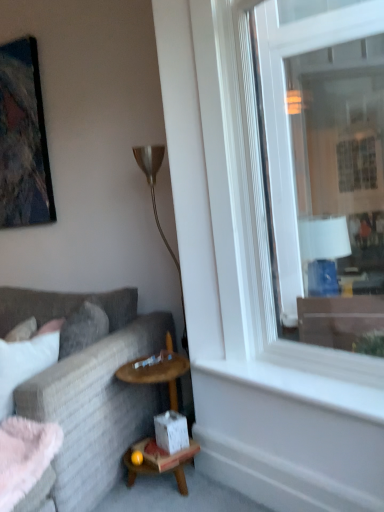
Question: Can you confirm if metallic gold floor lamp at center is positioned to the left of white smooth window sill at lower right?

Choices:
 (A) yes
 (B) no

Answer: (A)

Question: From the image's perspective, is metallic gold floor lamp at center below white smooth window sill at lower right?

Choices:
 (A) yes
 (B) no

Answer: (B)

Question: Can you confirm if metallic gold floor lamp at center is bigger than white smooth window sill at lower right?

Choices:
 (A) yes
 (B) no

Answer: (A)

Question: From a real-world perspective, is metallic gold floor lamp at center on top of white smooth window sill at lower right?

Choices:
 (A) no
 (B) yes

Answer: (B)

Question: Is white smooth window sill at lower right completely or partially inside metallic gold floor lamp at center?

Choices:
 (A) no
 (B) yes

Answer: (A)

Question: Considering the positions of matte black picture frame at upper left and white smooth window sill at lower right in the image, is matte black picture frame at upper left wider or thinner than white smooth window sill at lower right?

Choices:
 (A) wide
 (B) thin

Answer: (B)

Question: From a real-world perspective, is matte black picture frame at upper left above or below white smooth window sill at lower right?

Choices:
 (A) above
 (B) below

Answer: (A)

Question: Is matte black picture frame at upper left to the left or to the right of white smooth window sill at lower right in the image?

Choices:
 (A) left
 (B) right

Answer: (A)

Question: Considering the positions of point (11, 92) and point (299, 392), is point (11, 92) closer or farther from the camera than point (299, 392)?

Choices:
 (A) closer
 (B) farther

Answer: (B)

Question: Visually, is white smooth window sill at lower right positioned to the left or to the right of matte black picture frame at upper left?

Choices:
 (A) left
 (B) right

Answer: (B)

Question: In terms of size, does white smooth window sill at lower right appear bigger or smaller than matte black picture frame at upper left?

Choices:
 (A) small
 (B) big

Answer: (A)

Question: From a real-world perspective, is white smooth window sill at lower right physically located above or below matte black picture frame at upper left?

Choices:
 (A) below
 (B) above

Answer: (A)

Question: From the image's perspective, is white smooth window sill at lower right located above or below matte black picture frame at upper left?

Choices:
 (A) above
 (B) below

Answer: (B)

Question: Considering the positions of point (102, 379) and point (44, 147), is point (102, 379) closer or farther from the camera than point (44, 147)?

Choices:
 (A) farther
 (B) closer

Answer: (B)

Question: Visually, is textured gray couch at left positioned to the left or to the right of matte black picture frame at upper left?

Choices:
 (A) right
 (B) left

Answer: (A)